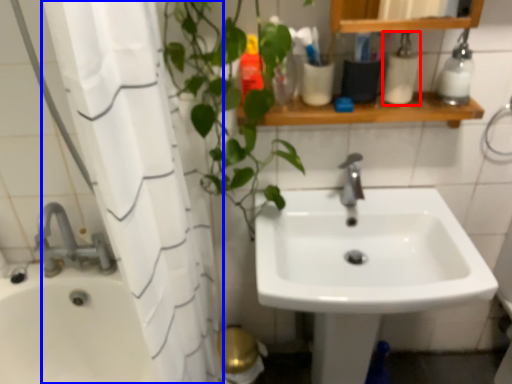
Question: Which object appears farthest to the camera in this image, toiletry (highlighted by a red box) or shower curtain (highlighted by a blue box)?

Choices:
 (A) toiletry
 (B) shower curtain

Answer: (A)